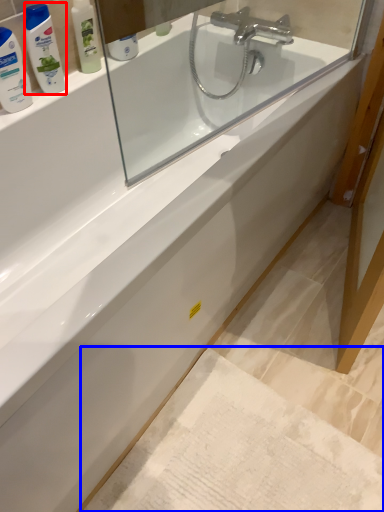
Question: Among these objects, which one is farthest to the camera, mouthwash (highlighted by a red box) or bath mat (highlighted by a blue box)?

Choices:
 (A) mouthwash
 (B) bath mat

Answer: (A)